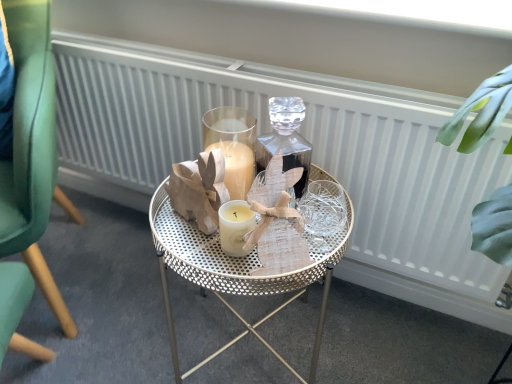
Consider the image. Measure the distance between point (85, 102) and camera.

4.17 feet.

The width and height of the screenshot is (512, 384). What are the coordinates of `metallic gold table at center` in the screenshot? It's located at (234, 273).

Find the location of a particular element. The width and height of the screenshot is (512, 384). white textured radiator at center is located at coordinates (302, 134).

How far apart are metallic gold table at center and white textured radiator at center?

13.15 inches.

Which is in front, metallic gold table at center or white textured radiator at center?

Positioned in front is metallic gold table at center.

Does metallic gold table at center contain white textured radiator at center?

No, white textured radiator at center is not surrounded by metallic gold table at center.

Which is in front, white textured radiator at center or green velvet chair at left?

green velvet chair at left is in front.

Is white textured radiator at center not inside green velvet chair at left?

That's correct, white textured radiator at center is outside of green velvet chair at left.

Based on the photo, looking at their sizes, would you say white textured radiator at center is wider or thinner than green velvet chair at left?

Considering their sizes, white textured radiator at center looks slimmer than green velvet chair at left.

Is white textured radiator at center next to green velvet chair at left?

No, white textured radiator at center is not making contact with green velvet chair at left.

Considering the relative positions of white textured radiator at center and metallic gold table at center in the image provided, is white textured radiator at center behind metallic gold table at center?

Yes, white textured radiator at center is further from the camera.

Does white textured radiator at center appear on the left side of metallic gold table at center?

No.

Does white textured radiator at center turn towards metallic gold table at center?

Yes.

Does point (365, 259) come in front of point (181, 219)?

No, (365, 259) is further to viewer.

The image size is (512, 384). I want to click on table below the green velvet chair at left (from a real-world perspective), so click(x=234, y=273).

Is green velvet chair at left far away from metallic gold table at center?

No, green velvet chair at left is not far away from metallic gold table at center.

From the image's perspective, is green velvet chair at left above metallic gold table at center?

Indeed, from the image's perspective, green velvet chair at left is shown above metallic gold table at center.

Considering the sizes of objects green velvet chair at left and metallic gold table at center in the image provided, who is wider, green velvet chair at left or metallic gold table at center?

green velvet chair at left.

Could you tell me if metallic gold table at center is turned towards green velvet chair at left?

No, metallic gold table at center is not facing towards green velvet chair at left.

Considering the positions of objects metallic gold table at center and green velvet chair at left in the image provided, who is more to the right, metallic gold table at center or green velvet chair at left?

metallic gold table at center is more to the right.

Is metallic gold table at center directly adjacent to green velvet chair at left?

No, metallic gold table at center is not in contact with green velvet chair at left.

Is green velvet chair at left located within metallic gold table at center?

No, green velvet chair at left is not inside metallic gold table at center.

Is green velvet chair at left far from white textured radiator at center?

No, green velvet chair at left is in close proximity to white textured radiator at center.

Considering the sizes of green velvet chair at left and white textured radiator at center in the image, is green velvet chair at left bigger or smaller than white textured radiator at center?

In the image, green velvet chair at left appears to be larger than white textured radiator at center.

From a real-world perspective, is green velvet chair at left above or below white textured radiator at center?

Clearly, from a real-world perspective, green velvet chair at left is above white textured radiator at center.

Is the depth of green velvet chair at left greater than that of white textured radiator at center?

No, green velvet chair at left is in front of white textured radiator at center.

Where is `radiator above the metallic gold table at center (from the image's perspective)`? radiator above the metallic gold table at center (from the image's perspective) is located at coordinates (302, 134).

You are a GUI agent. You are given a task and a screenshot of the screen. Output one action in this format:
    pyautogui.click(x=<x>, y=<y>)
    Task: Click on the radiator that appears below the green velvet chair at left (from the image's perspective)
    Image resolution: width=512 pixels, height=384 pixels.
    Given the screenshot: What is the action you would take?
    pyautogui.click(x=302, y=134)

Considering their positions, is green velvet chair at left positioned closer to metallic gold table at center than white textured radiator at center?

white textured radiator at center lies closer to metallic gold table at center than the other object.

Considering their positions, is white textured radiator at center positioned closer to green velvet chair at left than metallic gold table at center?

metallic gold table at center.

Estimate the real-world distances between objects in this image. Which object is further from green velvet chair at left, metallic gold table at center or white textured radiator at center?

The object further to green velvet chair at left is white textured radiator at center.

When comparing their distances from white textured radiator at center, does green velvet chair at left or metallic gold table at center seem closer?

The object closer to white textured radiator at center is metallic gold table at center.

Estimate the real-world distances between objects in this image. Which object is closer to metallic gold table at center, white textured radiator at center or green velvet chair at left?

white textured radiator at center is closer to metallic gold table at center.

Which object lies nearer to the anchor point white textured radiator at center, metallic gold table at center or green velvet chair at left?

metallic gold table at center.

The width and height of the screenshot is (512, 384). I want to click on table between green velvet chair at left and white textured radiator at center in the horizontal direction, so click(234, 273).